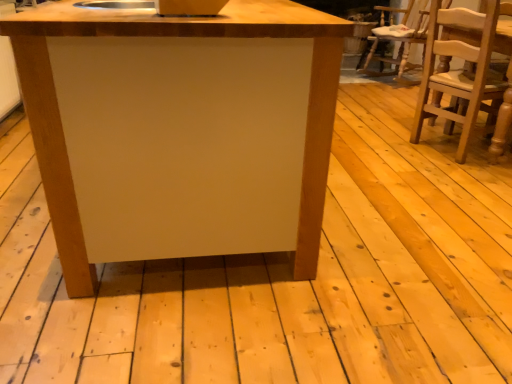
Question: Is point (142, 243) positioned closer to the camera than point (433, 104)?

Choices:
 (A) farther
 (B) closer

Answer: (B)

Question: Is matte wood table at center inside or outside of light brown wooden chair at right?

Choices:
 (A) inside
 (B) outside

Answer: (B)

Question: Is matte wood table at center in front of or behind light brown wooden chair at right in the image?

Choices:
 (A) behind
 (B) front

Answer: (B)

Question: Choose the correct answer: Is light brown wooden chair at right inside matte wood table at center or outside it?

Choices:
 (A) inside
 (B) outside

Answer: (B)

Question: From a real-world perspective, is light brown wooden chair at right physically located above or below matte wood table at center?

Choices:
 (A) above
 (B) below

Answer: (A)

Question: Relative to matte wood table at center, is light brown wooden chair at right in front or behind?

Choices:
 (A) behind
 (B) front

Answer: (A)

Question: Is light brown wooden chair at right to the left or to the right of matte wood table at center in the image?

Choices:
 (A) right
 (B) left

Answer: (A)